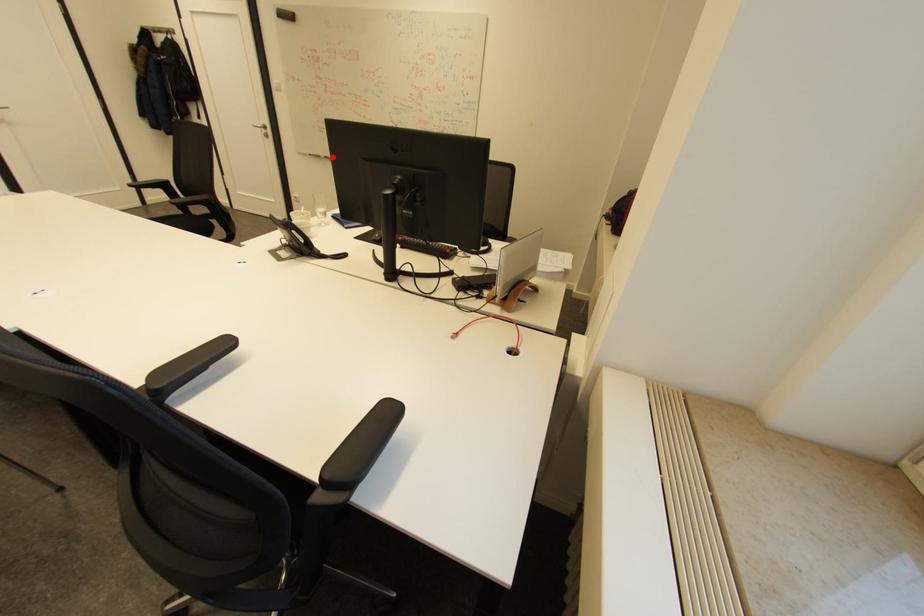
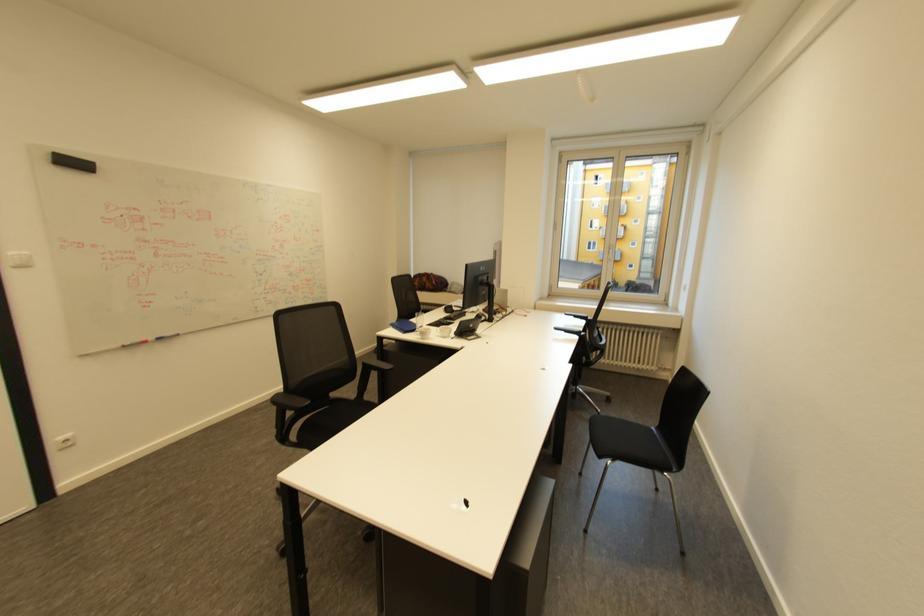
Question: I am providing you with two images of the same scene from different viewpoints. Image1 has a red point marked. In image2, the corresponding 3D location appears at what relative position? Reply with the corresponding letter.

Choices:
 (A) Closer
 (B) Farther

Answer: (A)